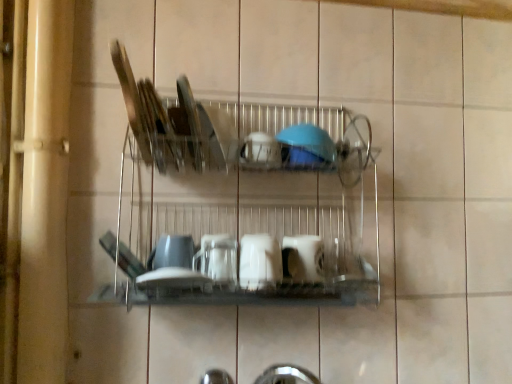
Question: From the image's perspective, is white glossy cup at center, which is the 1th tableware from bottom to top, on clear glass plate at center, the 1th tableware when ordered from top to bottom?

Choices:
 (A) no
 (B) yes

Answer: (A)

Question: Can you confirm if white glossy cup at center, the 6th tableware positioned from the top, is bigger than clear glass plate at center, the 6th tableware from the bottom?

Choices:
 (A) yes
 (B) no

Answer: (B)

Question: Could you tell me if white glossy cup at center, which is the 1th tableware from bottom to top, is facing clear glass plate at center, the 1th tableware when ordered from top to bottom?

Choices:
 (A) yes
 (B) no

Answer: (B)

Question: Is clear glass plate at center, the 6th tableware from the bottom, at the back of white glossy cup at center, the 6th tableware positioned from the top?

Choices:
 (A) yes
 (B) no

Answer: (B)

Question: Is clear glass plate at center, the 6th tableware from the bottom, surrounded by white glossy cup at center, which is the 1th tableware from bottom to top?

Choices:
 (A) yes
 (B) no

Answer: (B)

Question: Looking at their shapes, would you say white glossy cup at center, the 6th tableware positioned from the top, is wider or thinner than metallic silver dish rack at center?

Choices:
 (A) thin
 (B) wide

Answer: (A)

Question: From a real-world perspective, is white glossy cup at center, which is the 1th tableware from bottom to top, above or below metallic silver dish rack at center?

Choices:
 (A) below
 (B) above

Answer: (A)

Question: From the image's perspective, is white glossy cup at center, which is the 1th tableware from bottom to top, located above or below metallic silver dish rack at center?

Choices:
 (A) below
 (B) above

Answer: (A)

Question: Looking at the image, does white glossy cup at center, which is the 1th tableware from bottom to top, seem bigger or smaller compared to metallic silver dish rack at center?

Choices:
 (A) small
 (B) big

Answer: (A)

Question: Is point (318, 147) positioned closer to the camera than point (174, 258)?

Choices:
 (A) closer
 (B) farther

Answer: (B)

Question: Looking at their shapes, would you say blue matte bowl at upper center, the second tableware when ordered from top to bottom, is wider or thinner than matte white cup at center, which ranks as the second tableware in bottom-to-top order?

Choices:
 (A) thin
 (B) wide

Answer: (B)

Question: From the image's perspective, is blue matte bowl at upper center, the 5th tableware in the bottom-to-top sequence, above or below matte white cup at center, the 5th tableware from the top?

Choices:
 (A) above
 (B) below

Answer: (A)

Question: Do you think blue matte bowl at upper center, the second tableware when ordered from top to bottom, is within matte white cup at center, which ranks as the second tableware in bottom-to-top order, or outside of it?

Choices:
 (A) inside
 (B) outside

Answer: (B)

Question: Considering the relative positions of clear glass plate at center, the 1th tableware when ordered from top to bottom, and blue glossy bowl at center, the 3th tableware from the top, in the image provided, is clear glass plate at center, the 1th tableware when ordered from top to bottom, to the left or to the right of blue glossy bowl at center, the 3th tableware from the top,?

Choices:
 (A) left
 (B) right

Answer: (A)

Question: From their relative heights in the image, would you say clear glass plate at center, the 1th tableware when ordered from top to bottom, is taller or shorter than blue glossy bowl at center, which ranks as the fourth tableware in bottom-to-top order?

Choices:
 (A) short
 (B) tall

Answer: (B)